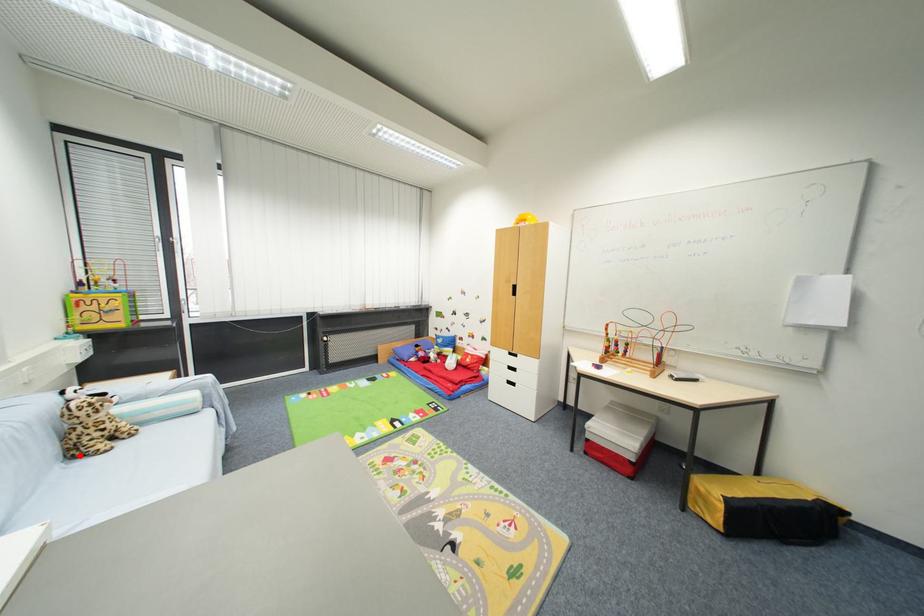
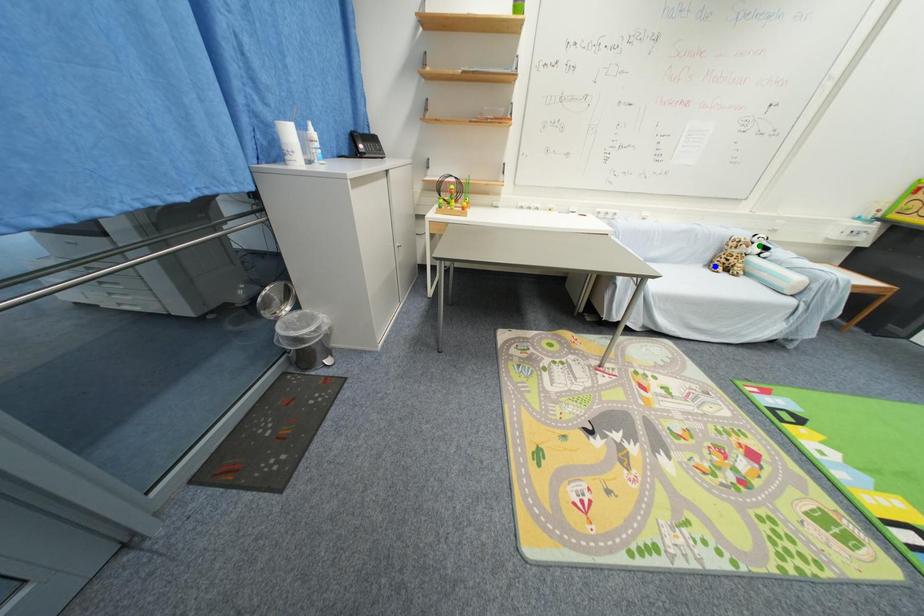
Question: I am providing you with two images of the same scene from different viewpoints. A red point is marked on the first image. You are given multiple points on the second image. Which spot in image 2 lines up with the point in image 1?

Choices:
 (A) yellow point
 (B) green point
 (C) blue point

Answer: (C)